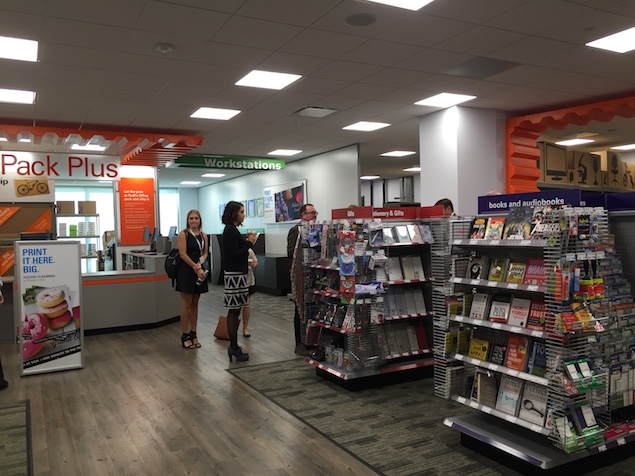
Find the location of a particular element. carpet is located at coordinates (364, 425), (13, 441).